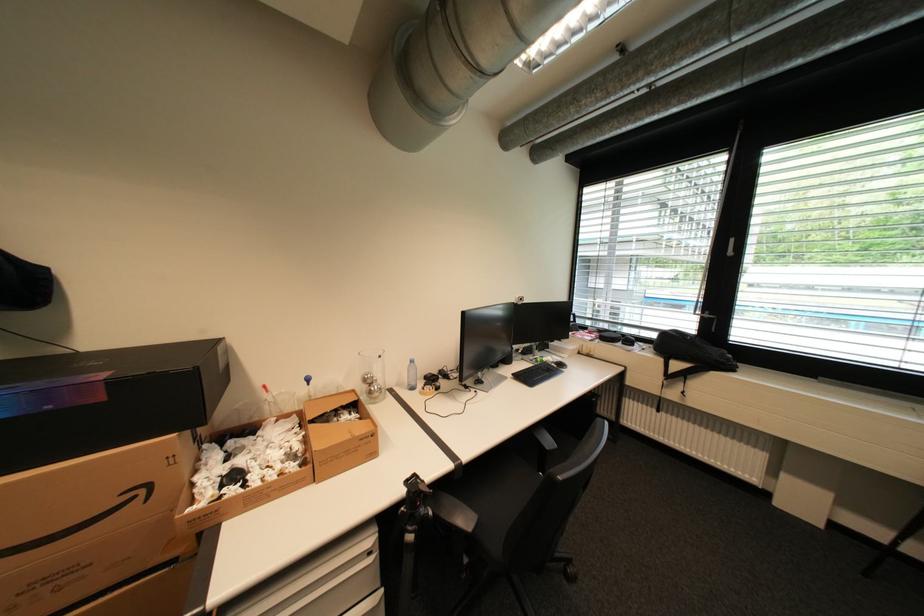
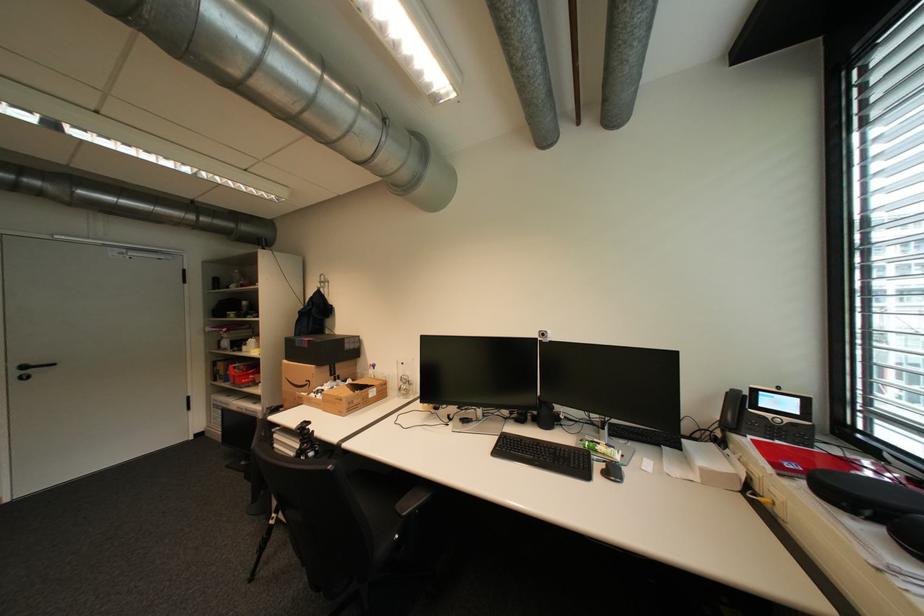
The point at (151, 491) is marked in the first image. Where is the corresponding point in the second image?

(317, 383)